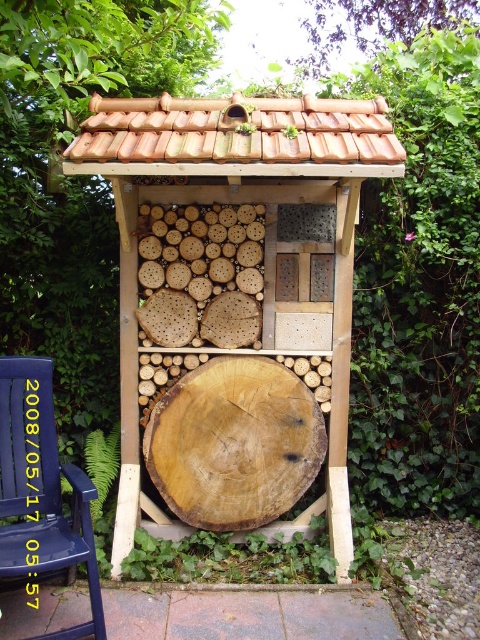
You are planning to place a blue wood chair at lower left next to the wooden insect hotel at center. Considering their widths, which one might require more space horizontally?

The wooden insect hotel at center might be wider than blue wood chair at lower left, so it might require more horizontal space.

You are sitting on the blue wood chair at lower left and want to look at the wooden insect hotel at center. In which direction should you look to see it?

You should look upward to see the wooden insect hotel at center because it is located above the blue wood chair at lower left.

You are standing in a garden and want to place a new flower pot 10 feet away from the wooden insect hotel at center. Can you place it directly in front of you without moving from your current position?

The wooden insect hotel at center is 8.56 feet away from you. Since the flower pot needs to be placed 10 feet away, you need to move forward 1.44 feet to position it correctly.